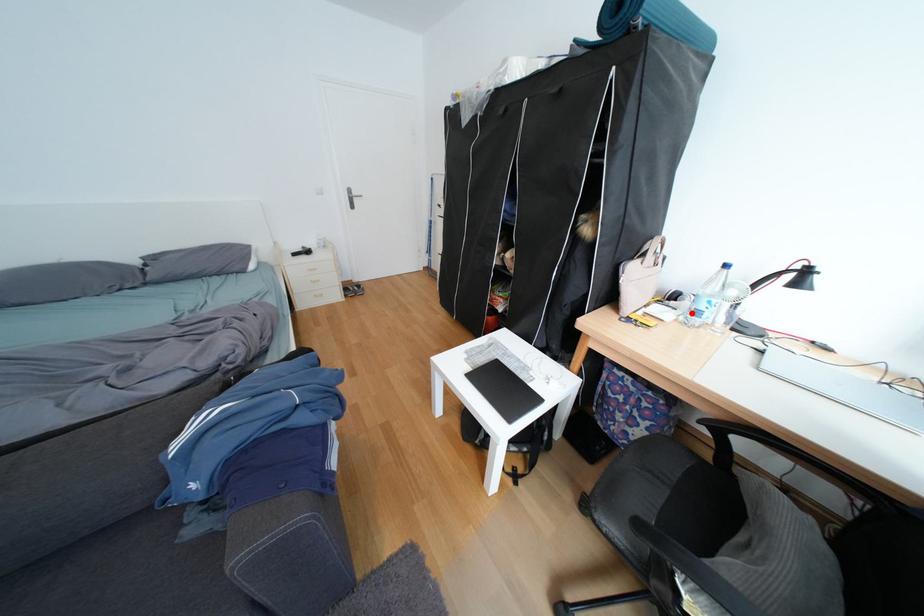
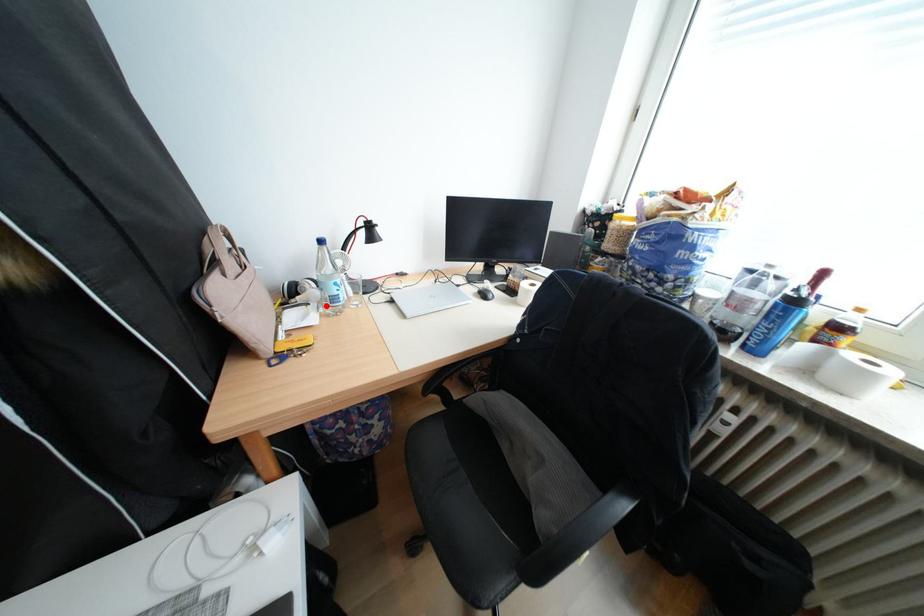
I am providing you with two images of the same scene from different viewpoints. A red point is marked on the first image and another point is marked on the second image. Does the point marked in image1 correspond to the same location as the one in image2?

Yes